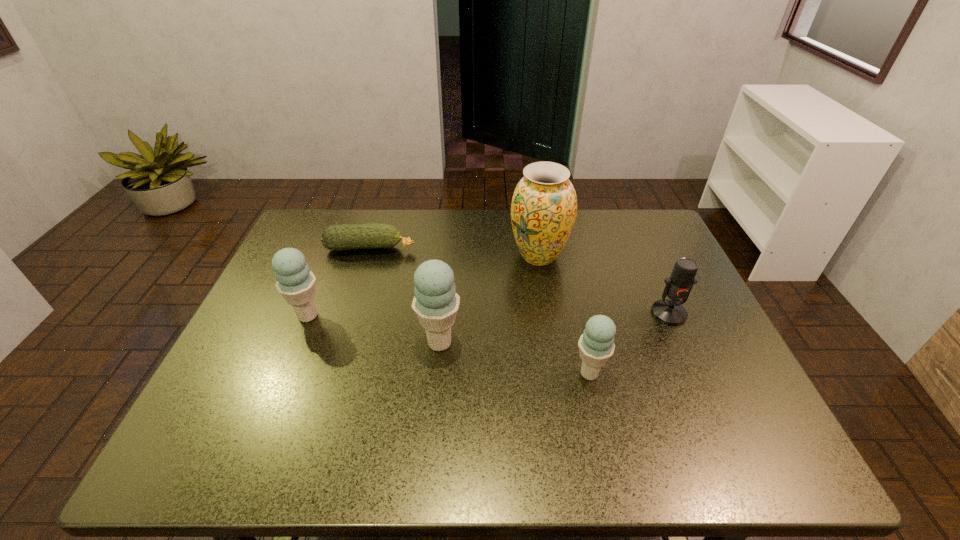
I want to click on free point between the shortest ice cream and the microphone, so click(629, 343).

Locate an element on the screen. This screenshot has height=540, width=960. free space between the rightmost object and the rightmost ice cream is located at coordinates (629, 343).

Find the location of `vacant area between the leftmost ice cream and the rightmost object`. vacant area between the leftmost ice cream and the rightmost object is located at coordinates (489, 315).

I want to click on vacant region between the microphone and the second ice cream from left to right, so click(554, 328).

Find the location of a particular element. vacant area that lies between the shortest ice cream and the microphone is located at coordinates (629, 343).

At what (x,y) coordinates should I click in order to perform the action: click on object identified as the closest to the leftmost ice cream. Please return your answer as a coordinate pair (x, y). Looking at the image, I should click on (351, 236).

Identify the location of object identified as the closest to the second shortest ice cream. (351, 236).

The image size is (960, 540). I want to click on ice cream that stands as the third closest to the shortest object, so click(596, 345).

I want to click on the closest ice cream relative to the vase, so click(x=435, y=303).

Where is `vacant area that satisfies the following two spatial constraints: 1. on the back side of the vase; 2. on the left side of the second ice cream from right to left`? vacant area that satisfies the following two spatial constraints: 1. on the back side of the vase; 2. on the left side of the second ice cream from right to left is located at coordinates (447, 256).